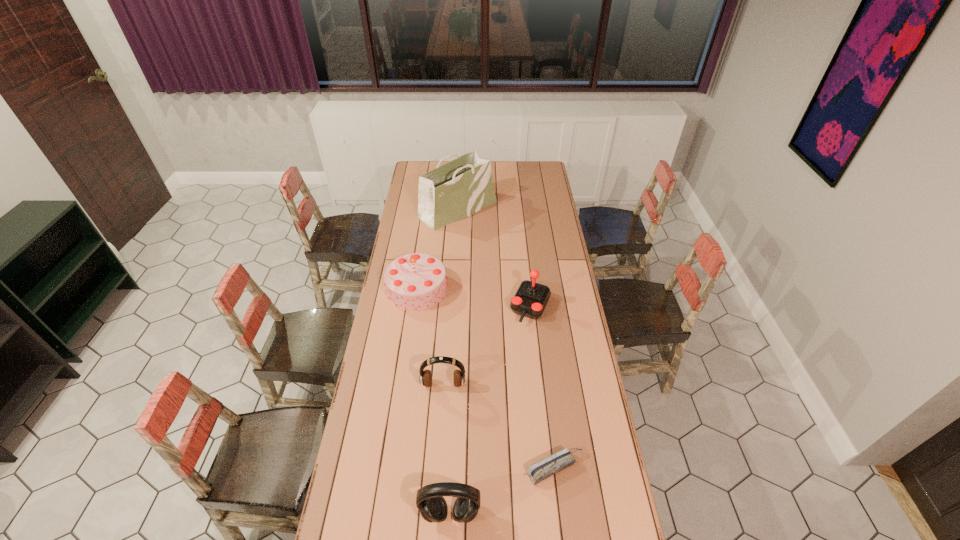
Where is `vacant space located 0.090m on the left of the joystick`? vacant space located 0.090m on the left of the joystick is located at coordinates (490, 307).

The width and height of the screenshot is (960, 540). I want to click on vacant position located 0.390m on the ear cup of the third nearest object, so click(436, 500).

In order to click on vacant area situated on the left of the shortest object in this screenshot , I will do `click(505, 468)`.

Find the location of a particular element. This screenshot has width=960, height=540. grocery bag that is at the left edge is located at coordinates coord(456,190).

This screenshot has width=960, height=540. I want to click on birthday cake present at the left edge, so click(x=417, y=281).

The width and height of the screenshot is (960, 540). I want to click on joystick that is at the right edge, so click(530, 300).

At what (x,y) coordinates should I click in order to perform the action: click on pencil box positioned at the right edge. Please return your answer as a coordinate pair (x, y). This screenshot has width=960, height=540. Looking at the image, I should click on (539, 471).

Image resolution: width=960 pixels, height=540 pixels. Identify the location of free spot at the left edge of the desktop. (382, 364).

Locate an element on the screen. The height and width of the screenshot is (540, 960). free region at the right edge is located at coordinates (595, 430).

This screenshot has height=540, width=960. In the image, there is a desktop. Identify the location of free space at the far left corner. (414, 166).